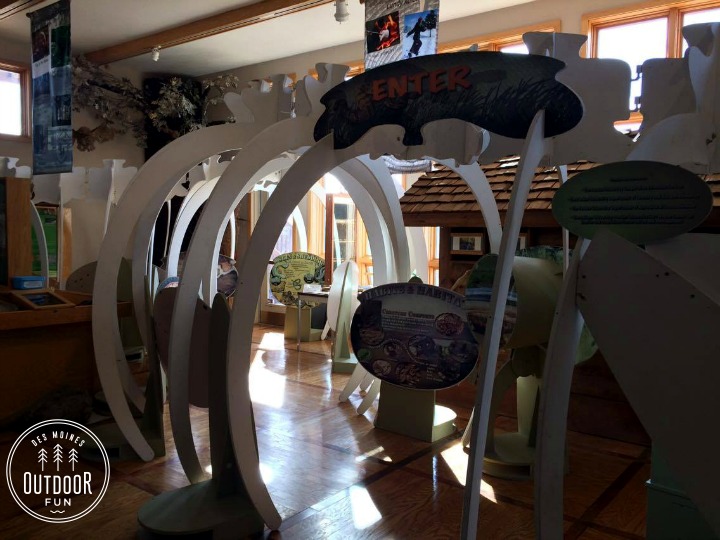
Where is `roof beams`? roof beams is located at coordinates (240, 21), (18, 5).